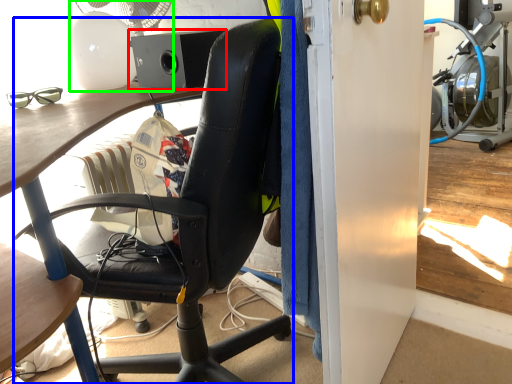
Question: Estimate the real-world distances between objects in this image. Which object is closer to loudspeaker (highlighted by a red box), chair (highlighted by a blue box) or mechanical fan (highlighted by a green box)?

Choices:
 (A) chair
 (B) mechanical fan

Answer: (B)